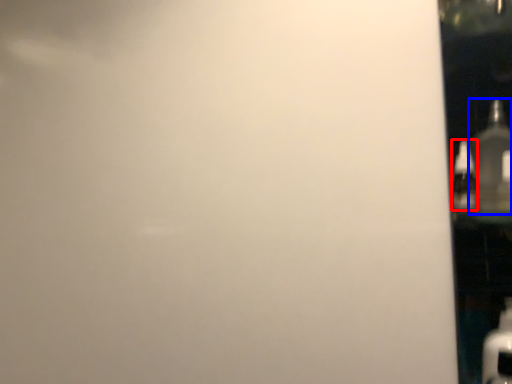
Question: Which object is closer to the camera taking this photo, bottle (highlighted by a red box) or bottle (highlighted by a blue box)?

Choices:
 (A) bottle
 (B) bottle

Answer: (B)